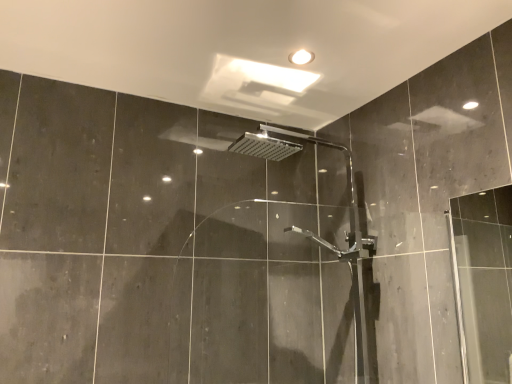
This screenshot has width=512, height=384. Find the location of `chrome metallic shower head at center`. chrome metallic shower head at center is located at coordinates (332, 246).

What do you see at coordinates (332, 246) in the screenshot? I see `chrome metallic shower head at center` at bounding box center [332, 246].

In order to face chrome metallic shower head at center, should I rotate leftwards or rightwards?

To align with it, rotate right about 7.148°.

Find the location of `white glossy light fixture at upper center`. white glossy light fixture at upper center is located at coordinates (301, 57).

Describe the element at coordinates (301, 57) in the screenshot. I see `white glossy light fixture at upper center` at that location.

Locate an element on the screen. The width and height of the screenshot is (512, 384). chrome metallic shower head at center is located at coordinates (332, 246).

Considering the positions of objects white glossy light fixture at upper center and chrome metallic shower head at center in the image provided, who is more to the left, white glossy light fixture at upper center or chrome metallic shower head at center?

Positioned to the left is white glossy light fixture at upper center.

Is white glossy light fixture at upper center further to the viewer compared to chrome metallic shower head at center?

Yes, the depth of white glossy light fixture at upper center is greater than that of chrome metallic shower head at center.

Does point (291, 57) lie in front of point (207, 144)?

Yes, point (291, 57) is in front of point (207, 144).

From the image's perspective, is white glossy light fixture at upper center below chrome metallic shower head at center?

Incorrect, from the image's perspective, white glossy light fixture at upper center is higher than chrome metallic shower head at center.

From a real-world perspective, relative to chrome metallic shower head at center, is white glossy light fixture at upper center vertically above or below?

white glossy light fixture at upper center is above chrome metallic shower head at center.

Considering the sizes of objects white glossy light fixture at upper center and chrome metallic shower head at center in the image provided, who is thinner, white glossy light fixture at upper center or chrome metallic shower head at center?

With smaller width is white glossy light fixture at upper center.

From the picture: Is white glossy light fixture at upper center taller than chrome metallic shower head at center?

No.

Who is bigger, white glossy light fixture at upper center or chrome metallic shower head at center?

With larger size is chrome metallic shower head at center.

Is white glossy light fixture at upper center located outside chrome metallic shower head at center?

Yes, white glossy light fixture at upper center is located beyond the bounds of chrome metallic shower head at center.

Is white glossy light fixture at upper center far from chrome metallic shower head at center?

Actually, white glossy light fixture at upper center and chrome metallic shower head at center are a little close together.

Is chrome metallic shower head at center at the back of white glossy light fixture at upper center?

No, white glossy light fixture at upper center is not facing the opposite direction of chrome metallic shower head at center.

How distant is white glossy light fixture at upper center from chrome metallic shower head at center?

white glossy light fixture at upper center is 25.08 inches from chrome metallic shower head at center.

At what (x,y) coordinates should I click in order to perform the action: click on screen door below the white glossy light fixture at upper center (from the image's perspective). Please return your answer as a coordinate pair (x, y). Looking at the image, I should click on (332, 246).

Based on their positions, is chrome metallic shower head at center located to the left or right of white glossy light fixture at upper center?

Based on their positions, chrome metallic shower head at center is located to the right of white glossy light fixture at upper center.

Which is in front, chrome metallic shower head at center or white glossy light fixture at upper center?

chrome metallic shower head at center is more forward.

Is point (281, 131) positioned behind point (290, 61)?

That is True.

In the scene shown: From the image's perspective, between chrome metallic shower head at center and white glossy light fixture at upper center, who is located below?

chrome metallic shower head at center appears lower in the image.

From a real-world perspective, which is physically above, chrome metallic shower head at center or white glossy light fixture at upper center?

white glossy light fixture at upper center.

Considering the relative sizes of chrome metallic shower head at center and white glossy light fixture at upper center in the image provided, is chrome metallic shower head at center wider than white glossy light fixture at upper center?

Yes.

Who is taller, chrome metallic shower head at center or white glossy light fixture at upper center?

With more height is chrome metallic shower head at center.

In the scene shown: Considering the relative sizes of chrome metallic shower head at center and white glossy light fixture at upper center in the image provided, is chrome metallic shower head at center smaller than white glossy light fixture at upper center?

Incorrect, chrome metallic shower head at center is not smaller in size than white glossy light fixture at upper center.

Is chrome metallic shower head at center inside or outside of white glossy light fixture at upper center?

The correct answer is: outside.

Are chrome metallic shower head at center and white glossy light fixture at upper center far apart?

No, chrome metallic shower head at center is not far from white glossy light fixture at upper center.

Is chrome metallic shower head at center facing towards white glossy light fixture at upper center?

No.

What's the angular difference between chrome metallic shower head at center and white glossy light fixture at upper center's facing directions?

There is a 0.00425-degree angle between the facing directions of chrome metallic shower head at center and white glossy light fixture at upper center.

This screenshot has height=384, width=512. I want to click on light fixture lying behind the chrome metallic shower head at center, so click(x=301, y=57).

In the image, there is a white glossy light fixture at upper center. Where is `screen door below it (from a real-world perspective)`? Image resolution: width=512 pixels, height=384 pixels. screen door below it (from a real-world perspective) is located at coordinates (332, 246).

Find the location of `light fixture located on the left of chrome metallic shower head at center`. light fixture located on the left of chrome metallic shower head at center is located at coordinates (301, 57).